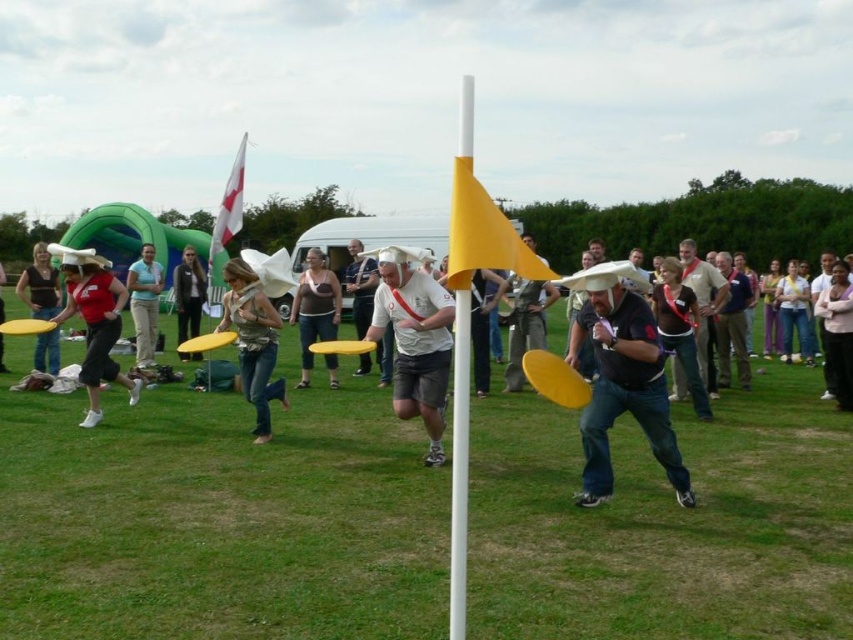
The width and height of the screenshot is (853, 640). Describe the element at coordinates (622, 385) in the screenshot. I see `matte black frisbee at center` at that location.

Who is positioned more to the right, matte black frisbee at center or matte red shirt at left?

Positioned to the right is matte black frisbee at center.

Where is `matte black frisbee at center`? This screenshot has width=853, height=640. matte black frisbee at center is located at coordinates (622, 385).

The width and height of the screenshot is (853, 640). Describe the element at coordinates (415, 340) in the screenshot. I see `white matte jersey at center` at that location.

Is point (419, 353) closer to viewer compared to point (254, 276)?

That is True.

The width and height of the screenshot is (853, 640). What are the coordinates of `white matte jersey at center` in the screenshot? It's located at (415, 340).

At what (x,y) coordinates should I click in order to perform the action: click on white matte jersey at center. Please return your answer as a coordinate pair (x, y). Looking at the image, I should click on (415, 340).

Can you confirm if yellow matte flag at center is taller than white fabric flag at upper left?

No.

Who is more forward, (x=450, y=240) or (x=234, y=172)?

Positioned in front is point (x=450, y=240).

The height and width of the screenshot is (640, 853). I want to click on yellow matte flag at center, so click(x=483, y=234).